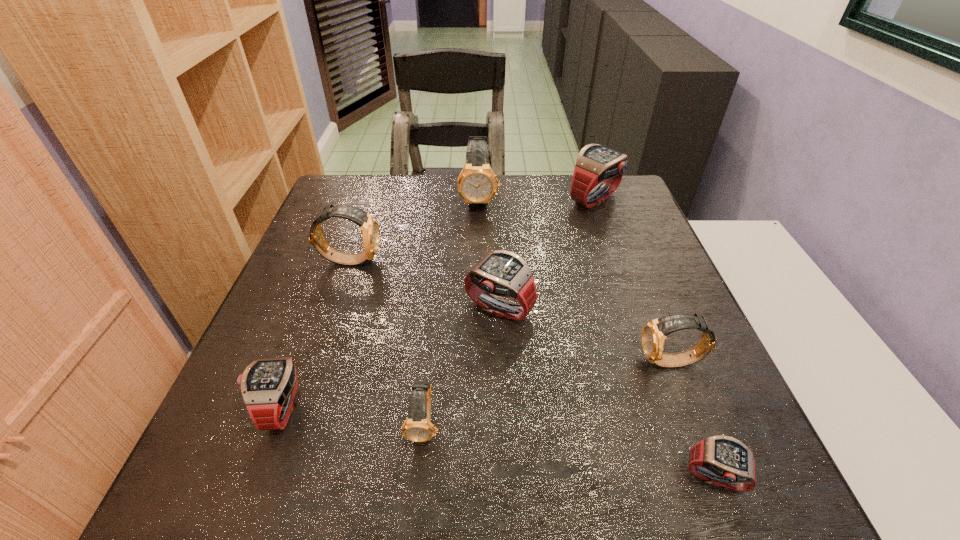
This screenshot has width=960, height=540. I want to click on blank space located on the face of the third biggest gold watch, so click(468, 362).

Where is `vacant area situated 0.110m on the face of the third biggest gold watch`? This screenshot has height=540, width=960. vacant area situated 0.110m on the face of the third biggest gold watch is located at coordinates (583, 362).

Identify the location of free space located on the back of the second nearest red watch. (314, 319).

The width and height of the screenshot is (960, 540). I want to click on vacant space situated on the face of the third object from left to right, so click(419, 480).

Locate an element on the screen. free space located on the back of the nearest watch is located at coordinates (666, 354).

Where is `object that is at the near edge`? object that is at the near edge is located at coordinates (721, 460).

At what (x,y) coordinates should I click in order to perform the action: click on object that is at the far right corner. Please return your answer as a coordinate pair (x, y). Looking at the image, I should click on (596, 164).

At what (x,y) coordinates should I click in order to perform the action: click on object that is at the near right corner. Please return your answer as a coordinate pair (x, y). The height and width of the screenshot is (540, 960). Looking at the image, I should click on (721, 460).

Image resolution: width=960 pixels, height=540 pixels. In order to click on vacant area at the far edge in this screenshot , I will do `click(559, 199)`.

In the image, there is a desktop. Where is `vacant space at the near edge`? The height and width of the screenshot is (540, 960). vacant space at the near edge is located at coordinates (313, 466).